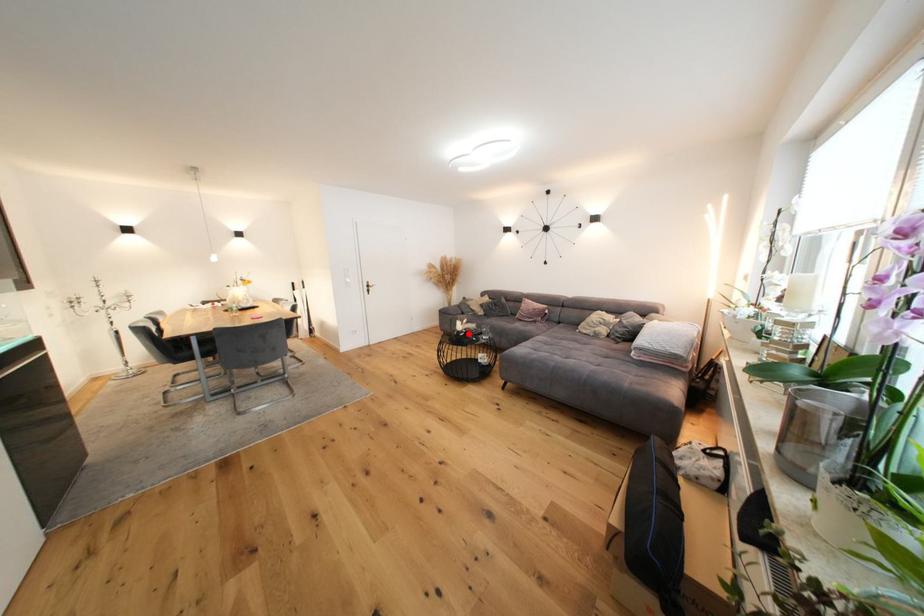
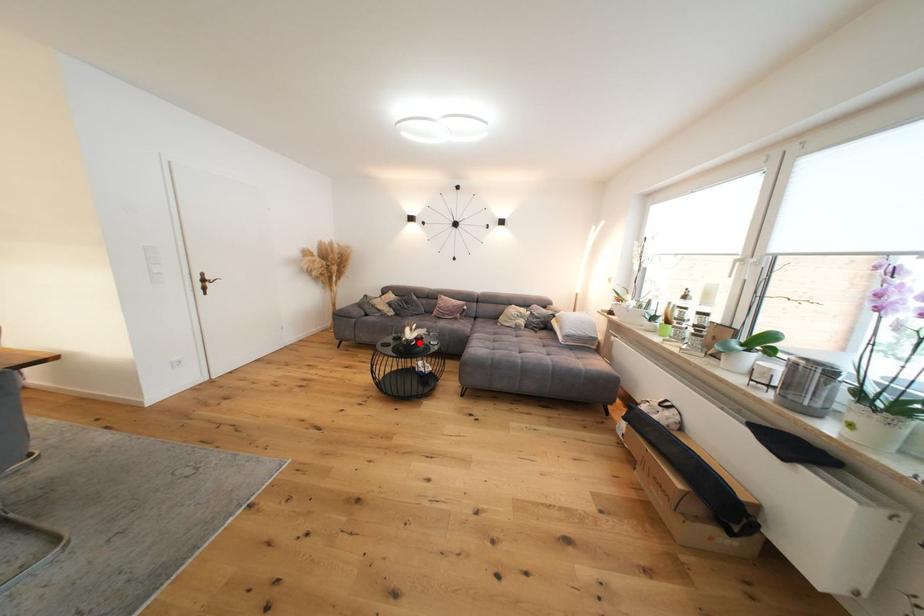
I am providing you with two images of the same scene from different viewpoints. A red point is marked on the first image and another point is marked on the second image. Are the points marked in image1 and image2 representing the same 3D position?

Yes